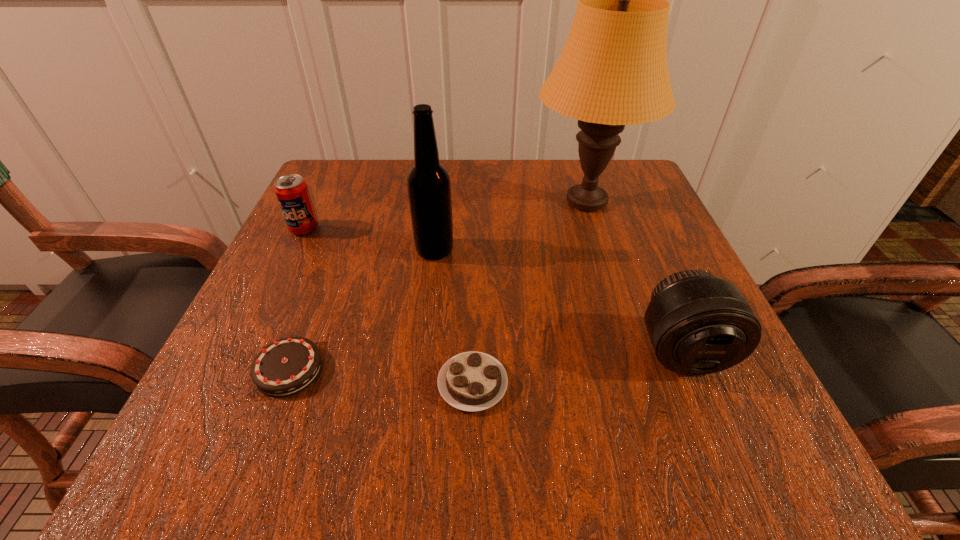
The image size is (960, 540). I want to click on free point at the near edge, so click(475, 423).

Where is `vacant space at the left edge of the desktop`? This screenshot has height=540, width=960. vacant space at the left edge of the desktop is located at coordinates pos(334,295).

Locate an element on the screen. Image resolution: width=960 pixels, height=540 pixels. free space at the right edge of the desktop is located at coordinates (636, 316).

The height and width of the screenshot is (540, 960). In the image, there is a desktop. Identify the location of vacant space at the far left corner. (345, 178).

Find the location of `free space at the near left corner of the desktop`. free space at the near left corner of the desktop is located at coordinates (292, 462).

In the image, there is a desktop. Identify the location of free region at the near right corner. The height and width of the screenshot is (540, 960). (653, 416).

Locate an element on the screen. The image size is (960, 540). free space between the soda can and the telephoto lens is located at coordinates (493, 290).

The image size is (960, 540). What are the coordinates of `free space between the third tallest object and the third shortest object` in the screenshot? It's located at coord(493,290).

Identify the location of empty space between the right chocolate cake and the lampshade. (529, 293).

Find the location of a particular element. empty space between the fourth tallest object and the beer bottle is located at coordinates (370, 239).